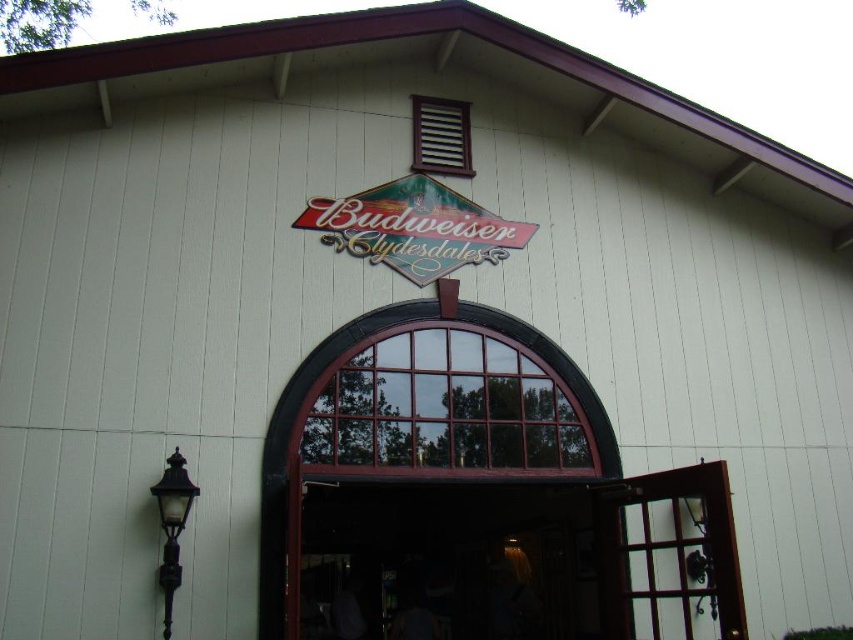
Based on the photo, you are standing in front of the building and notice two points marked on the facade. The first point is at coordinates point (x=436, y=339) and the second is at point (x=415, y=256). Which point is closer to you?

Point (x=436, y=339) is closer to the camera than point (x=415, y=256), so the first point is closer to you.

You are standing in front of the building shown in the image and want to enter through the wooden door at center. Based on the coordinates provided, can you estimate the door location relative to the Budweiser Clydesdales sign?

The wooden door at center is located below the Budweiser Clydesdales sign since its coordinates are at point (479, 490), which places it lower on the facade than the sign positioned at the top center.